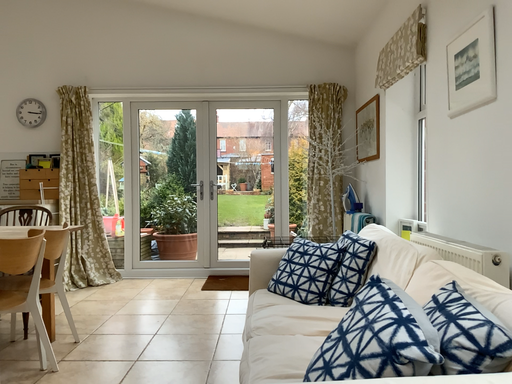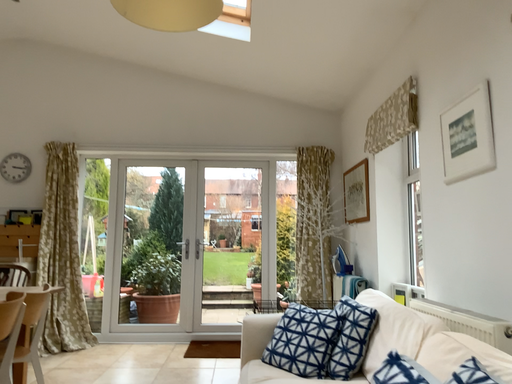
Question: How did the camera likely rotate when shooting the video?

Choices:
 (A) rotated downward
 (B) rotated upward

Answer: (B)